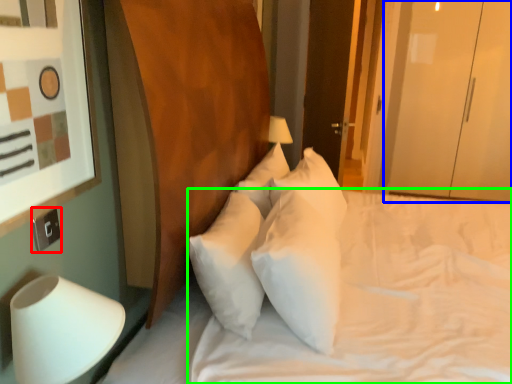
Question: Which is farther away from electric outlet (highlighted by a red box)? glass door (highlighted by a blue box) or mattress (highlighted by a green box)?

Choices:
 (A) glass door
 (B) mattress

Answer: (A)